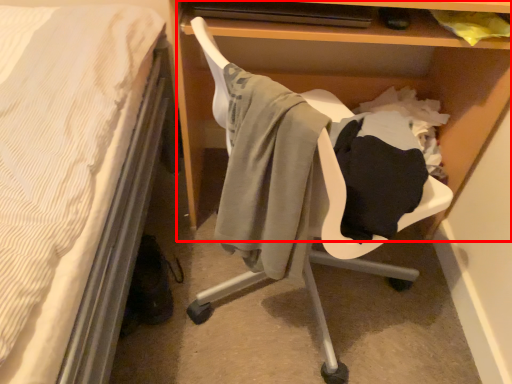
Question: From the image's perspective, considering the relative positions of shelf (annotated by the red box) and swivel chair in the image provided, where is shelf (annotated by the red box) located with respect to the staircase?

Choices:
 (A) above
 (B) below

Answer: (A)